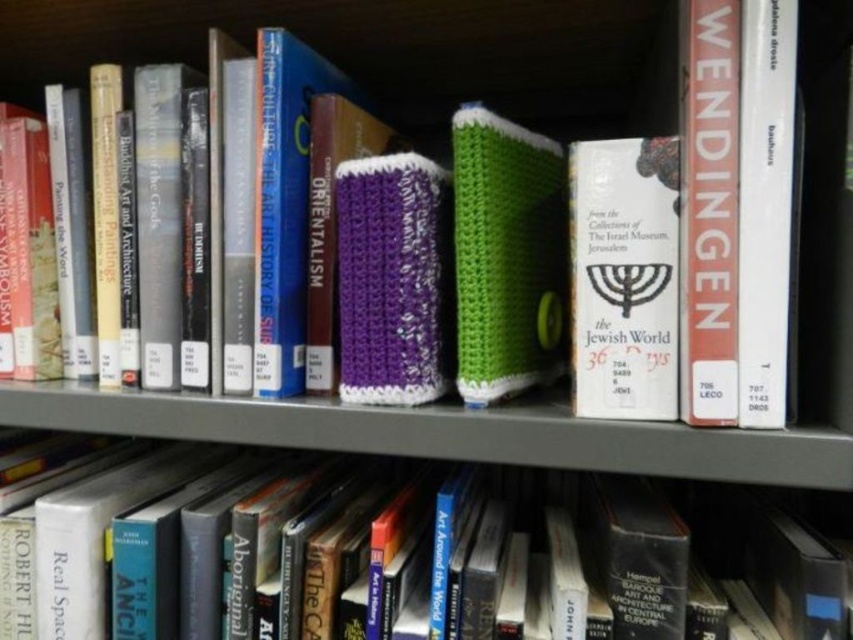
Can you confirm if white paper book at center is positioned above green knitted book at center?

Incorrect, white paper book at center is not positioned above green knitted book at center.

Where is `white paper book at center`? This screenshot has width=853, height=640. white paper book at center is located at coordinates click(624, 276).

Does hardcover book at center have a greater height compared to white paper book at center?

In fact, hardcover book at center may be shorter than white paper book at center.

Is hardcover book at center bigger than white paper book at center?

Correct, hardcover book at center is larger in size than white paper book at center.

Which is in front, point (0, 592) or point (674, 288)?

Point (674, 288) is in front.

Image resolution: width=853 pixels, height=640 pixels. I want to click on hardcover book at center, so click(x=325, y=545).

Looking at this image, can you confirm if hardcover book at center is shorter than green knitted book at center?

Yes.

Which is in front, point (200, 520) or point (526, 316)?

Point (200, 520) is more forward.

You are a GUI agent. You are given a task and a screenshot of the screen. Output one action in this format:
    pyautogui.click(x=<x>, y=<y>)
    Task: Click on the hardcover book at center
    The image size is (853, 640).
    Given the screenshot: What is the action you would take?
    pyautogui.click(x=325, y=545)